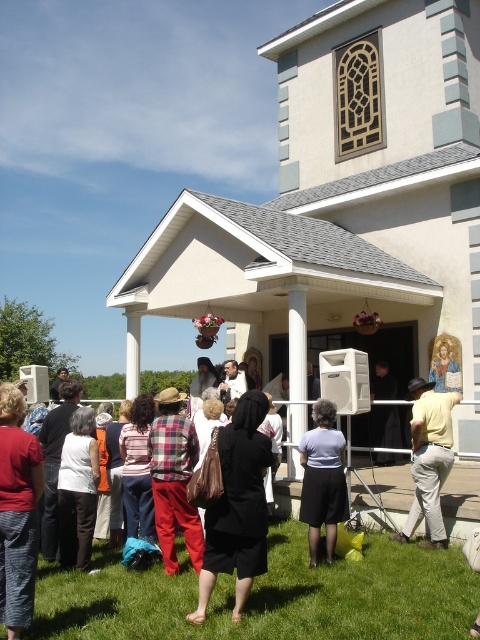
Question: Can you confirm if yellow cotton shirt at center is bigger than black fabric at center?

Choices:
 (A) yes
 (B) no

Answer: (A)

Question: Can you confirm if green grass at lower center is positioned above yellow cotton shirt at center?

Choices:
 (A) yes
 (B) no

Answer: (B)

Question: Based on their relative distances, which object is farther from the plaid fabric pants at center?

Choices:
 (A) black fabric at center
 (B) dark gray pants at lower left
 (C) red plaid shirt at lower left
 (D) yellow cotton shirt at center

Answer: (A)

Question: Which point appears farthest from the camera in this image?

Choices:
 (A) (156, 417)
 (B) (451, 424)
 (C) (308, 465)

Answer: (B)

Question: Is plaid fabric pants at center positioned behind yellow cotton shirt at center?

Choices:
 (A) yes
 (B) no

Answer: (B)

Question: Which object is positioned closest to the light purple fabric skirt at center?

Choices:
 (A) green grass at lower center
 (B) black fabric at center
 (C) red plaid shirt at lower left
 (D) black matte dress at center

Answer: (A)